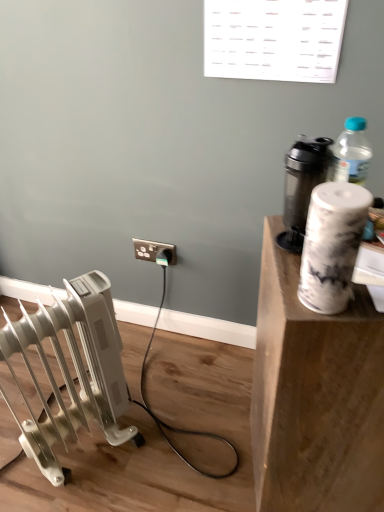
Question: Should I look upward or downward to see white plastic radiator at lower left?

Choices:
 (A) up
 (B) down

Answer: (B)

Question: Does white marble paper towel at upper right come in front of white plastic radiator at lower left?

Choices:
 (A) yes
 (B) no

Answer: (A)

Question: Is white marble paper towel at upper right to the right of white plastic radiator at lower left from the viewer's perspective?

Choices:
 (A) yes
 (B) no

Answer: (A)

Question: From the image's perspective, is white marble paper towel at upper right under white plastic radiator at lower left?

Choices:
 (A) yes
 (B) no

Answer: (B)

Question: Is white marble paper towel at upper right positioned beyond the bounds of white plastic radiator at lower left?

Choices:
 (A) yes
 (B) no

Answer: (A)

Question: Is there a large distance between white marble paper towel at upper right and white plastic radiator at lower left?

Choices:
 (A) yes
 (B) no

Answer: (B)

Question: Can you confirm if white marble paper towel at upper right is shorter than white plastic radiator at lower left?

Choices:
 (A) yes
 (B) no

Answer: (A)

Question: Can you confirm if white marble paper towel at upper right is wider than white marble cup at upper right?

Choices:
 (A) yes
 (B) no

Answer: (B)

Question: Considering the relative sizes of white marble paper towel at upper right and white marble cup at upper right in the image provided, is white marble paper towel at upper right smaller than white marble cup at upper right?

Choices:
 (A) yes
 (B) no

Answer: (A)

Question: Can you confirm if white marble paper towel at upper right is taller than white marble cup at upper right?

Choices:
 (A) no
 (B) yes

Answer: (A)

Question: Is white marble paper towel at upper right at the right side of white marble cup at upper right?

Choices:
 (A) yes
 (B) no

Answer: (B)

Question: Is white marble paper towel at upper right further to camera compared to white marble cup at upper right?

Choices:
 (A) no
 (B) yes

Answer: (A)

Question: From a real-world perspective, does white marble paper towel at upper right sit lower than white marble cup at upper right?

Choices:
 (A) yes
 (B) no

Answer: (B)

Question: Does white marble cup at upper right lie in front of black plastic electric outlet at center?

Choices:
 (A) yes
 (B) no

Answer: (A)